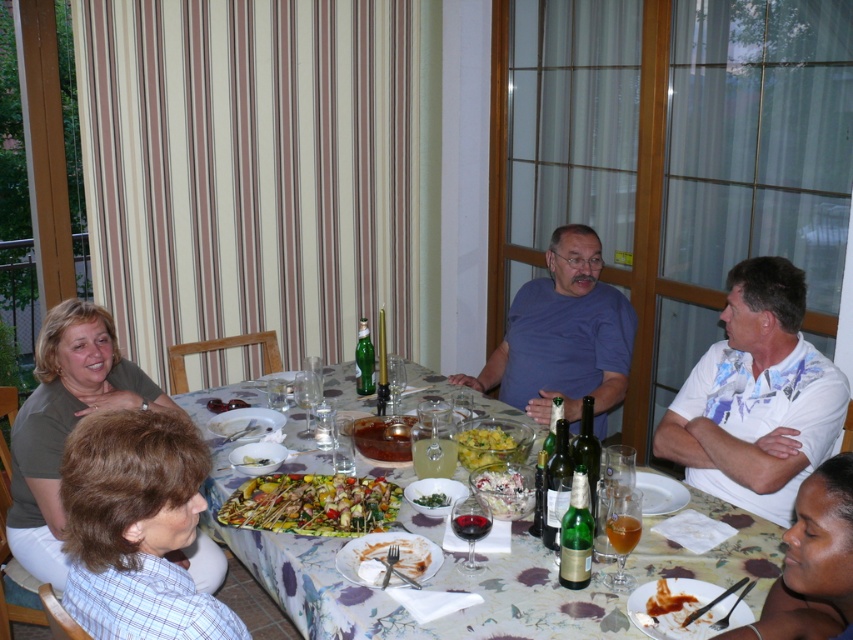
Question: From the image, what is the correct spatial relationship of brown plaid shirt at lower left in relation to thick brown sauce at lower right?

Choices:
 (A) below
 (B) above

Answer: (B)

Question: From the image, what is the correct spatial relationship of white floral shirt at right in relation to white matte plate at lower center?

Choices:
 (A) above
 (B) below

Answer: (A)

Question: Among these points, which one is farthest from the camera?

Choices:
 (A) (581, 326)
 (B) (706, 433)
 (C) (36, 538)

Answer: (A)

Question: Is dark brown skin at lower right to the left of green leafy salad at center from the viewer's perspective?

Choices:
 (A) yes
 (B) no

Answer: (B)

Question: Based on their relative distances, which object is farther from the yellow/green salad at center?

Choices:
 (A) yellowish matte skewers at center
 (B) thick brown sauce at lower right

Answer: (B)

Question: Which point appears closest to the camera in this image?

Choices:
 (A) (726, 440)
 (B) (485, 476)

Answer: (B)